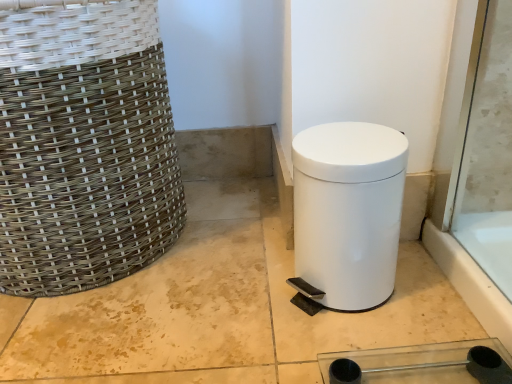
What do you see at coordinates (83, 145) in the screenshot? I see `white woven basket at left` at bounding box center [83, 145].

The height and width of the screenshot is (384, 512). I want to click on white woven basket at left, so click(x=83, y=145).

You are a GUI agent. You are given a task and a screenshot of the screen. Output one action in this format:
    pyautogui.click(x=<x>, y=<y>)
    Task: Click on the white glossy trash can at lower right
    Image resolution: width=512 pixels, height=384 pixels.
    Given the screenshot: What is the action you would take?
    pyautogui.click(x=348, y=212)

This screenshot has width=512, height=384. What do you see at coordinates (348, 212) in the screenshot?
I see `white glossy trash can at lower right` at bounding box center [348, 212].

Where is `white woven basket at left`? The width and height of the screenshot is (512, 384). white woven basket at left is located at coordinates (83, 145).

Which is more to the right, white glossy trash can at lower right or white woven basket at left?

Positioned to the right is white glossy trash can at lower right.

Is white glossy trash can at lower right positioned in front of white woven basket at left?

No, the depth of white glossy trash can at lower right is greater than that of white woven basket at left.

Is point (314, 266) in front of point (66, 268)?

Yes, point (314, 266) is closer to viewer.

From the image's perspective, relative to white woven basket at left, is white glossy trash can at lower right above or below?

Based on their image positions, white glossy trash can at lower right is located beneath white woven basket at left.

From a real-world perspective, is white glossy trash can at lower right positioned above or below white woven basket at left?

From a real-world perspective, white glossy trash can at lower right is physically below white woven basket at left.

Which of these two, white glossy trash can at lower right or white woven basket at left, is wider?

white woven basket at left.

Between white glossy trash can at lower right and white woven basket at left, which one has less height?

white glossy trash can at lower right is shorter.

Does white glossy trash can at lower right have a larger size compared to white woven basket at left?

Actually, white glossy trash can at lower right might be smaller than white woven basket at left.

Which is correct: white glossy trash can at lower right is inside white woven basket at left, or outside of it?

white glossy trash can at lower right is not inside white woven basket at left, it's outside.

Is white glossy trash can at lower right far from white woven basket at left?

white glossy trash can at lower right is actually quite close to white woven basket at left.

Could you tell me if white glossy trash can at lower right is facing white woven basket at left?

No, white glossy trash can at lower right is not turned towards white woven basket at left.

This screenshot has width=512, height=384. Find the location of `waste container on the right of white woven basket at left`. waste container on the right of white woven basket at left is located at coordinates (348, 212).

Based on the photo, is white woven basket at left to the right of white glossy trash can at lower right from the viewer's perspective?

Incorrect, white woven basket at left is not on the right side of white glossy trash can at lower right.

Which object is further away from the camera, white woven basket at left or white glossy trash can at lower right?

white glossy trash can at lower right is further away from the camera.

From the picture: Which point is more forward, (30, 233) or (306, 152)?

The point (306, 152) is in front.

From the image's perspective, which is above, white woven basket at left or white glossy trash can at lower right?

white woven basket at left appears higher in the image.

From a real-world perspective, is white woven basket at left physically below white glossy trash can at lower right?

No, from a real-world perspective, white woven basket at left is not below white glossy trash can at lower right.

Which of these two, white woven basket at left or white glossy trash can at lower right, is thinner?

With smaller width is white glossy trash can at lower right.

Which of these two, white woven basket at left or white glossy trash can at lower right, stands taller?

With more height is white woven basket at left.

Does white woven basket at left have a larger size compared to white glossy trash can at lower right?

Yes, white woven basket at left is bigger than white glossy trash can at lower right.

Can we say white woven basket at left lies outside white glossy trash can at lower right?

white woven basket at left lies outside white glossy trash can at lower right's area.

In the scene shown: Is white woven basket at left next to white glossy trash can at lower right?

No, white woven basket at left is not touching white glossy trash can at lower right.

Is white woven basket at left looking in the opposite direction of white glossy trash can at lower right?

No, white woven basket at left's orientation is not away from white glossy trash can at lower right.

Measure the distance between white woven basket at left and white glossy trash can at lower right.

They are 13.70 inches apart.

Image resolution: width=512 pixels, height=384 pixels. Find the location of `basket positioned vertically above the white glossy trash can at lower right (from a real-world perspective)`. basket positioned vertically above the white glossy trash can at lower right (from a real-world perspective) is located at coordinates (83, 145).

I want to click on waste container that appears below the white woven basket at left (from a real-world perspective), so click(348, 212).

Identify the location of waste container behind the white woven basket at left. (348, 212).